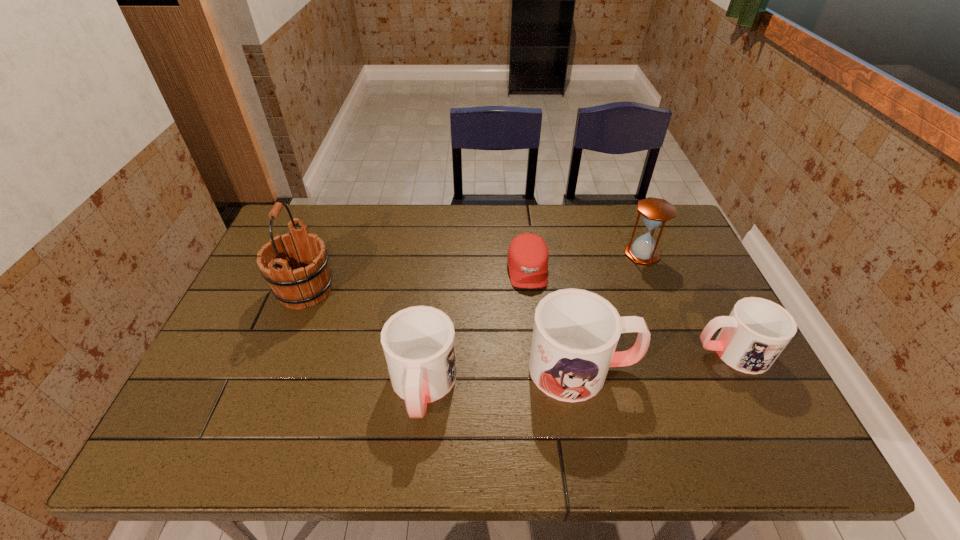
The height and width of the screenshot is (540, 960). Find the location of `vacant space located 0.240m on the side of the fifth tallest object with the handle`. vacant space located 0.240m on the side of the fifth tallest object with the handle is located at coordinates (599, 352).

This screenshot has width=960, height=540. Find the location of `vacant space positioned on the side of the fifth tallest object with the handle`. vacant space positioned on the side of the fifth tallest object with the handle is located at coordinates pyautogui.click(x=612, y=352).

Locate an element on the screen. free space located 0.310m on the side of the fifth tallest object with the handle is located at coordinates (571, 352).

Find the location of `blank space located on the left of the hourglass`. blank space located on the left of the hourglass is located at coordinates (525, 254).

Find the location of a particular element. vacant space situated on the front-facing side of the cap is located at coordinates (540, 377).

This screenshot has width=960, height=540. Identify the location of vacant space located on the right of the tallest object. (368, 291).

The height and width of the screenshot is (540, 960). In order to click on object situated at the far edge in this screenshot , I will do `click(655, 212)`.

At what (x,y) coordinates should I click in order to perform the action: click on object that is at the left edge. Please return your answer as a coordinate pair (x, y). This screenshot has height=540, width=960. Looking at the image, I should click on (310, 282).

The width and height of the screenshot is (960, 540). Identify the location of mug at the right edge. (757, 330).

You are a GUI agent. You are given a task and a screenshot of the screen. Output one action in this format:
    pyautogui.click(x=<x>, y=<y>)
    Task: Click on the hourglass that is positioned at the right edge
    The height and width of the screenshot is (540, 960).
    Given the screenshot: What is the action you would take?
    pyautogui.click(x=655, y=212)